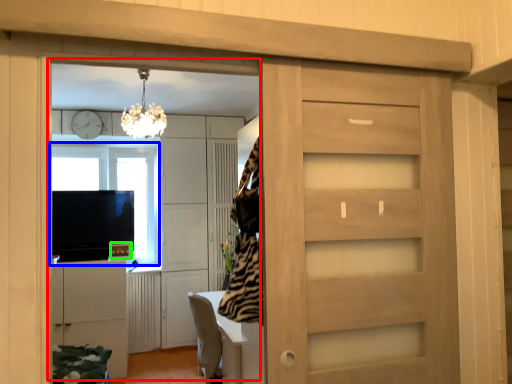
Question: Which is nearer to the entertainment center (highlighted by a red box)? window (highlighted by a blue box) or appliance (highlighted by a green box).

Choices:
 (A) window
 (B) appliance

Answer: (A)